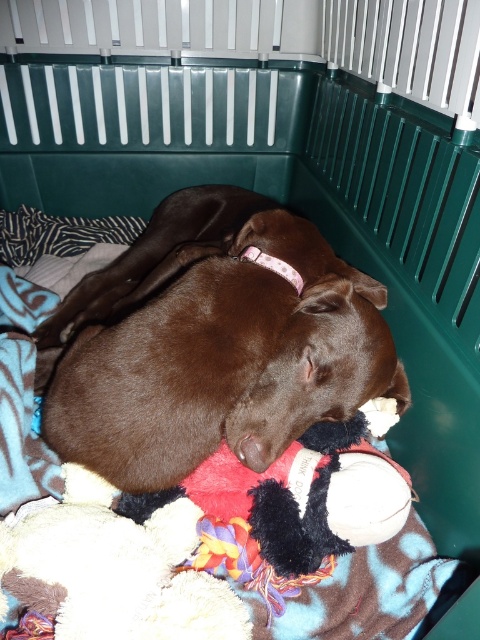
You are a veterinarian checking the crate of a brown smooth dog at center and a soft plush dog bed at center. Based on their sizes, can the dog fit comfortably on the bed without any part of its body hanging off?

The brown smooth dog at center might be wider than the soft plush dog bed at center, so there is a possibility that parts of the dog may hang off the bed if the bed is narrower than the dog.

Looking at this image, you are a veterinarian examining an image of a dog in a crate. The dog is labeled as the brown smooth dog at center. Based on its position coordinates, can you determine if the dog is positioned towards the front or the back of the crate?

The brown smooth dog at center is positioned at coordinates point (225, 360). Since the coordinates are in the center area, the dog is likely positioned towards the middle of the crate.

Based on the scene description, can the brown smooth dog at center fit entirely on the soft plush dog bed at center?

The brown smooth dog at center is larger in size than the soft plush dog bed at center, so it cannot fit entirely on the bed.